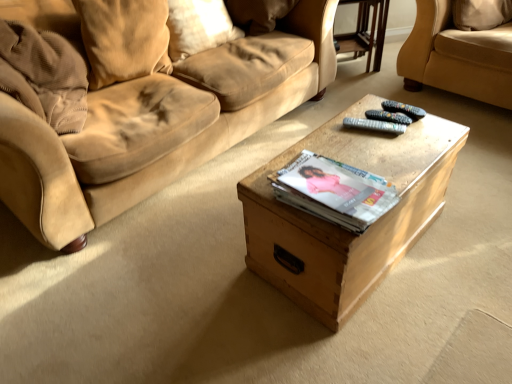
Locate an element on the screen. The height and width of the screenshot is (384, 512). free space to the left of black plastic remote at center, positioned as the first remote in top-to-bottom order is located at coordinates (364, 115).